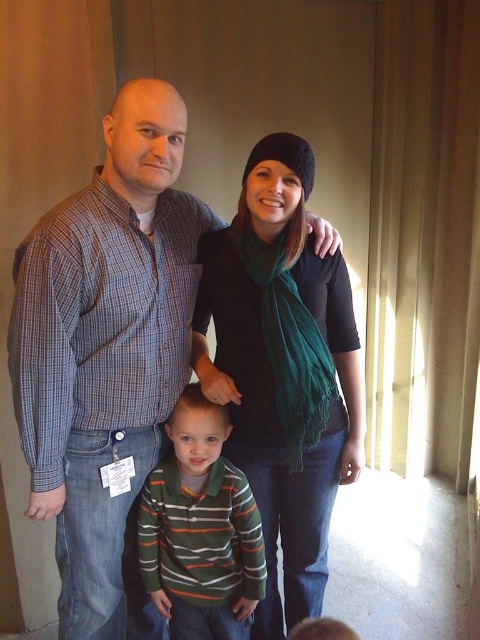
Question: Which point is farther to the camera?

Choices:
 (A) (177, 620)
 (B) (90, 376)

Answer: (A)

Question: Estimate the real-world distances between objects in this image. Which object is closer to the black soft scarf at center?

Choices:
 (A) striped cotton shirt at center
 (B) plaid shirt at center

Answer: (A)

Question: Can you confirm if plaid shirt at center is smaller than striped cotton shirt at center?

Choices:
 (A) yes
 (B) no

Answer: (B)

Question: Is black soft scarf at center in front of striped cotton shirt at center?

Choices:
 (A) no
 (B) yes

Answer: (B)

Question: Is plaid shirt at center positioned in front of striped cotton shirt at center?

Choices:
 (A) no
 (B) yes

Answer: (B)

Question: Which point is farther from the camera taking this photo?

Choices:
 (A) click(262, 540)
 (B) click(334, 410)

Answer: (A)